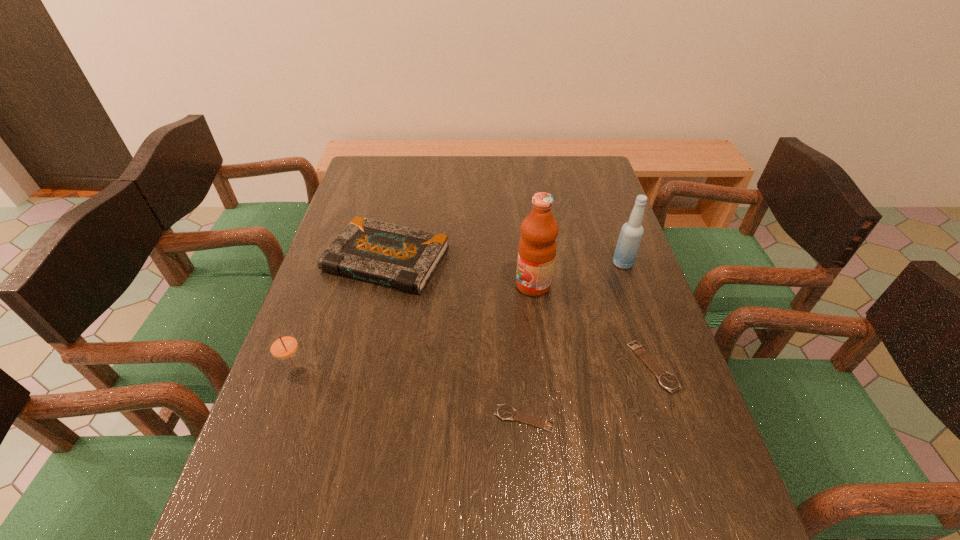
All watchs are currently evenly spaced. To continue this pattern, where would you add another watch on the left? Please point out a vacant spot. Please provide its 2D coordinates. Your answer should be formatted as a tuple, i.e. [(x, y)], where the tuple contains the x and y coordinates of a point satisfying the conditions above.

[(367, 483)]